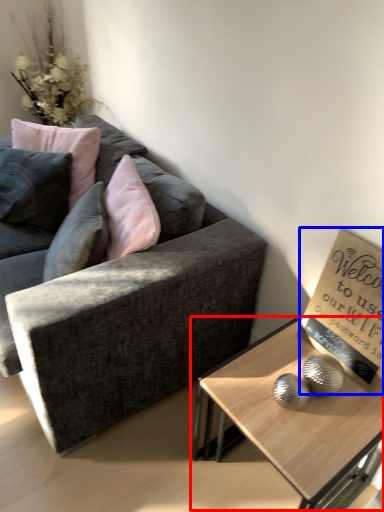
Question: Which point is further to the camera, coffee table (highlighted by a red box) or bulletin board (highlighted by a blue box)?

Choices:
 (A) coffee table
 (B) bulletin board

Answer: (B)